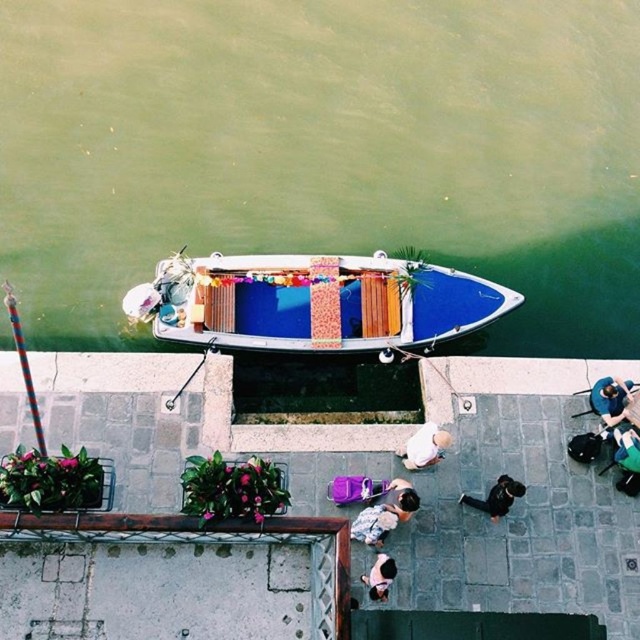
In the scene shown: You are a photographer standing on the bridge and see the smooth beige shirt at center and the light brown leather jacket at lower center. Which item is positioned more to the right side of the scene?

The smooth beige shirt at center is positioned to the right of the light brown leather jacket at lower center, so the smooth beige shirt at center is more to the right side of the scene.

You are standing on the bridge and want to observe both the green water at boat top and the smooth beige shirt at center. Which object is closer to you?

The green water at boat top is closer to you because it is further to the viewer than the smooth beige shirt at center.